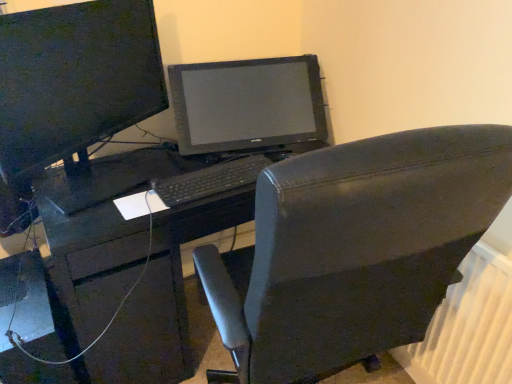
Question: From a real-world perspective, does black plastic keyboard at center sit lower than matte black monitor at upper left?

Choices:
 (A) yes
 (B) no

Answer: (A)

Question: Is black plastic keyboard at center shorter than matte black monitor at upper left?

Choices:
 (A) yes
 (B) no

Answer: (A)

Question: Is black plastic keyboard at center far from matte black monitor at upper left?

Choices:
 (A) yes
 (B) no

Answer: (B)

Question: Does black plastic keyboard at center lie behind matte black monitor at upper left?

Choices:
 (A) no
 (B) yes

Answer: (B)

Question: From the image's perspective, is black plastic keyboard at center on top of matte black monitor at upper left?

Choices:
 (A) yes
 (B) no

Answer: (B)

Question: Does black plastic keyboard at center turn towards matte black monitor at upper left?

Choices:
 (A) yes
 (B) no

Answer: (B)

Question: Does matte black desk at center have a lesser height compared to white plastic radiator at lower right?

Choices:
 (A) yes
 (B) no

Answer: (B)

Question: Does matte black desk at center have a lesser width compared to white plastic radiator at lower right?

Choices:
 (A) no
 (B) yes

Answer: (A)

Question: Is matte black desk at center smaller than white plastic radiator at lower right?

Choices:
 (A) yes
 (B) no

Answer: (B)

Question: Is matte black desk at center outside white plastic radiator at lower right?

Choices:
 (A) yes
 (B) no

Answer: (A)

Question: From the image's perspective, does matte black desk at center appear lower than white plastic radiator at lower right?

Choices:
 (A) yes
 (B) no

Answer: (B)

Question: From a real-world perspective, is matte black desk at center physically below white plastic radiator at lower right?

Choices:
 (A) yes
 (B) no

Answer: (B)

Question: Is matte black monitor at upper left thinner than matte black desk at center?

Choices:
 (A) no
 (B) yes

Answer: (B)